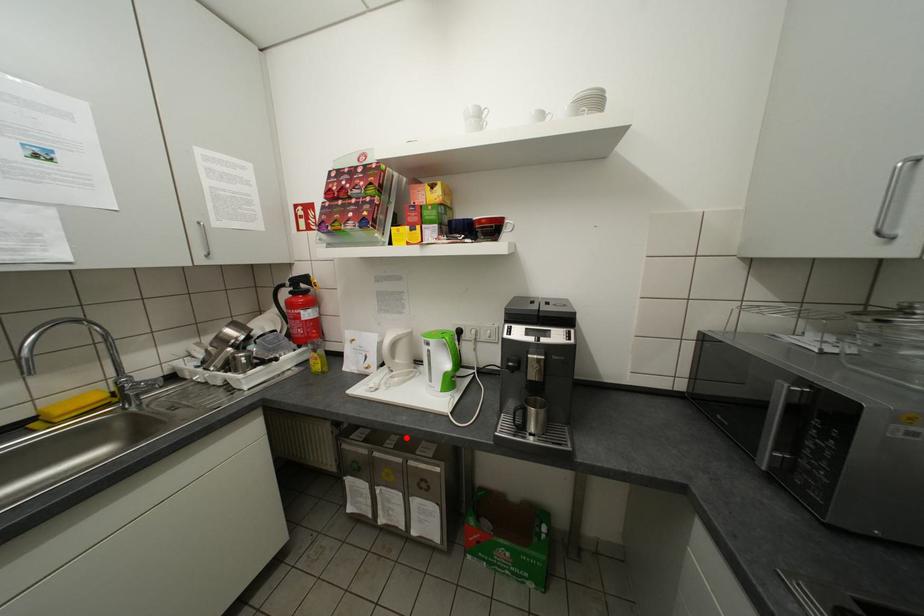
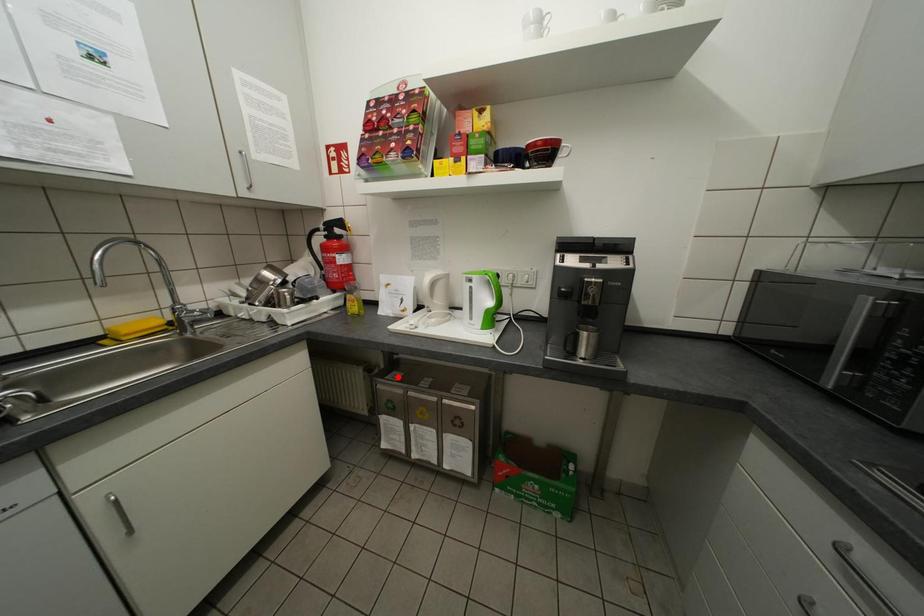
I am providing you with two images of the same scene from different viewpoints. A red point is marked on the first image and another point is marked on the second image. Is the marked point in image1 the same physical position as the marked point in image2?

No